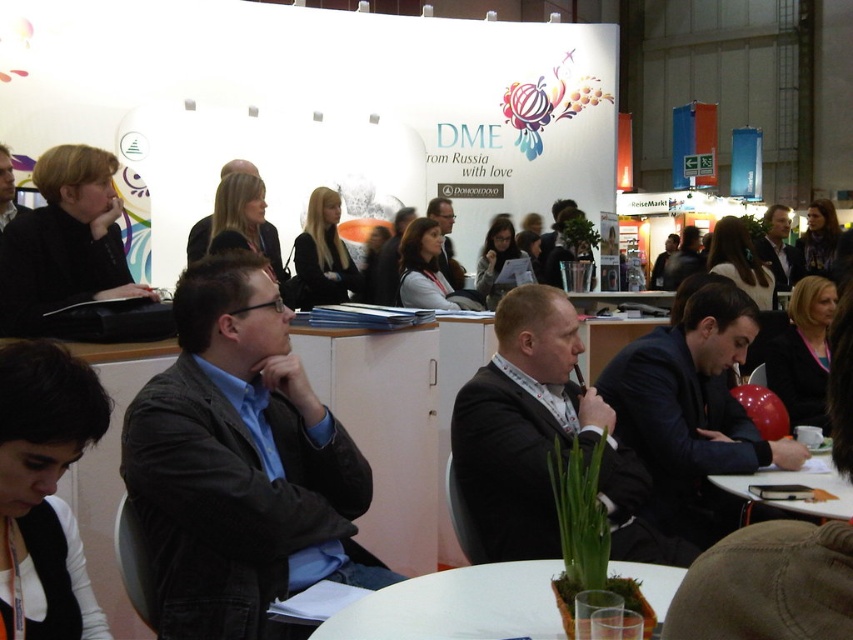
Question: From the image, what is the correct spatial relationship of black suit at center in relation to matte black jacket at center?

Choices:
 (A) right
 (B) left

Answer: (A)

Question: Can you confirm if dark gray jacket at center is positioned above white paper at lower right?

Choices:
 (A) yes
 (B) no

Answer: (A)

Question: Which of the following is the farthest from the observer?

Choices:
 (A) black suit at center
 (B) white paper at lower right
 (C) dark gray jacket at center

Answer: (A)

Question: Can you confirm if white plastic table at center is positioned above matte black jacket at center?

Choices:
 (A) yes
 (B) no

Answer: (B)

Question: Which point is farther to the camera?

Choices:
 (A) dark suit at center
 (B) white plastic table at center
 (C) dark gray jacket at center
 (D) black suit at center

Answer: (A)

Question: Which point is farther to the camera?

Choices:
 (A) (816, 464)
 (B) (614, 528)
 (C) (286, 564)

Answer: (A)